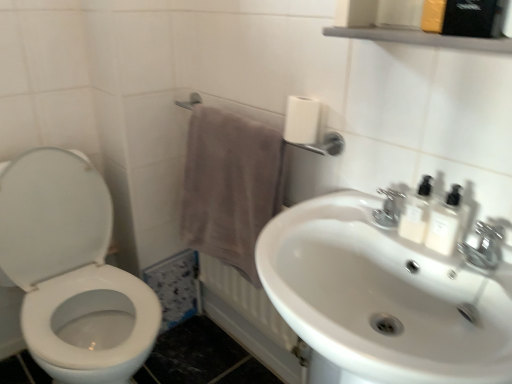
Question: Relative to white opaque bottles at upper right, arranged as the 1th mouthwash when viewed from the right, is metallic gray shelf at upper center in front or behind?

Choices:
 (A) behind
 (B) front

Answer: (B)

Question: Is metallic gray shelf at upper center wider or thinner than white opaque bottles at upper right, arranged as the 1th mouthwash when viewed from the right?

Choices:
 (A) thin
 (B) wide

Answer: (B)

Question: Estimate the real-world distances between objects in this image. Which object is closer to the chrome metallic faucet at upper right?

Choices:
 (A) white glossy toilet at left
 (B) metallic gray shelf at upper center
 (C) brown fabric towel at lower center
 (D) white glossy sink at center
 (E) white opaque bottles at upper right, which is the second mouthwash in left-to-right order

Answer: (E)

Question: Which of these objects is positioned farthest from the white glossy sink at center?

Choices:
 (A) white glossy toilet at left
 (B) white opaque bottles at upper right, which is the second mouthwash in left-to-right order
 (C) white matte toilet paper at upper right
 (D) metallic gray shelf at upper center
 (E) chrome metallic faucet at upper right

Answer: (A)